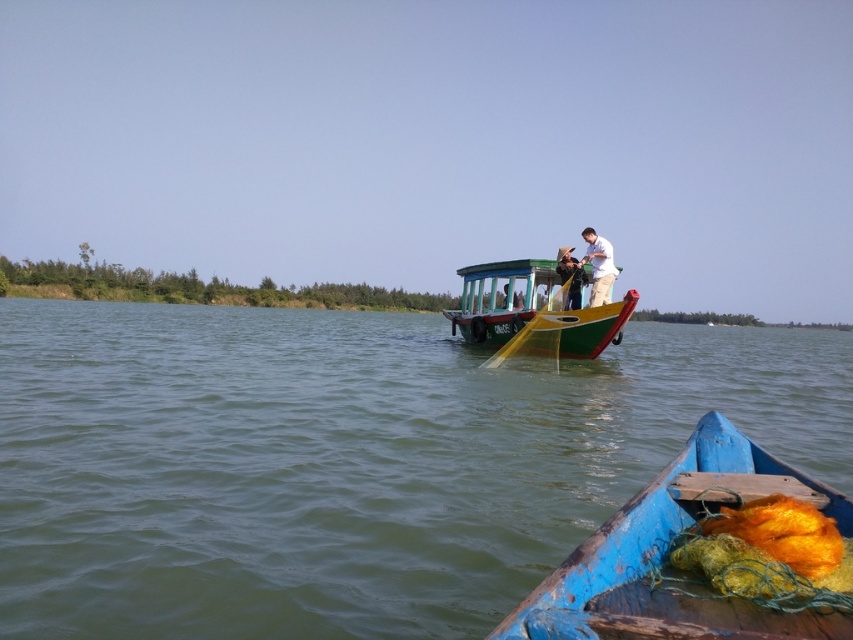
Question: Is green wooden boat at center smaller than white matte shirt at upper right?

Choices:
 (A) yes
 (B) no

Answer: (B)

Question: Which of these objects is positioned farthest from the green painted wood boat at center?

Choices:
 (A) green wooden boat at center
 (B) blue wooden boat at lower right
 (C) white matte shirt at upper right

Answer: (B)

Question: Is blue wooden boat at lower right smaller than white matte shirt at upper right?

Choices:
 (A) no
 (B) yes

Answer: (B)

Question: Is green wooden boat at center above white matte shirt at upper right?

Choices:
 (A) yes
 (B) no

Answer: (B)

Question: Estimate the real-world distances between objects in this image. Which object is farther from the green painted wood boat at center?

Choices:
 (A) white matte shirt at upper right
 (B) blue wooden boat at lower right

Answer: (B)

Question: Which point appears closest to the camera in this image?

Choices:
 (A) (566, 582)
 (B) (160, 440)
 (C) (474, 264)

Answer: (A)